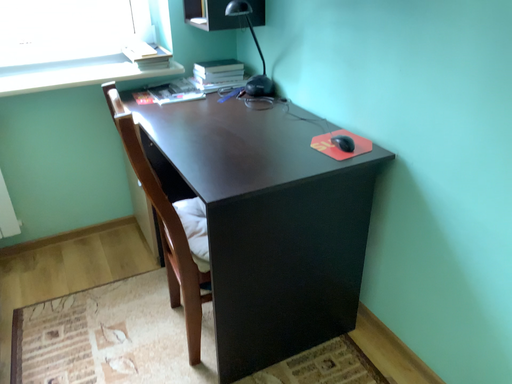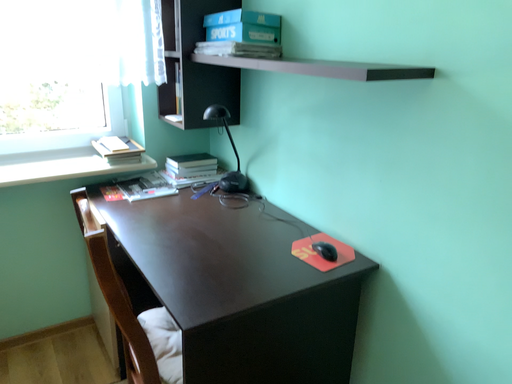
Question: How did the camera likely rotate when shooting the video?

Choices:
 (A) rotated downward
 (B) rotated upward

Answer: (B)